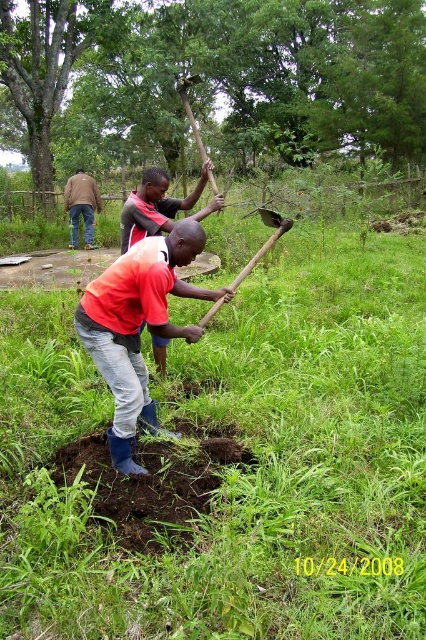
Is green leafy tree at upper center to the right of denim jacket at upper left from the viewer's perspective?

Correct, you'll find green leafy tree at upper center to the right of denim jacket at upper left.

Who is shorter, green leafy tree at upper center or denim jacket at upper left?

Standing shorter between the two is denim jacket at upper left.

Who is more forward, [37,129] or [77,180]?

Positioned in front is point [77,180].

Find the location of a particular element. green leafy tree at upper center is located at coordinates (216, 80).

Is green leafy tree at upper center further to camera compared to matte red shirt at center?

That is True.

Is point (400, 141) positioned behind point (180, 296)?

Yes.

The height and width of the screenshot is (640, 426). Identify the location of green leafy tree at upper center. (216, 80).

Is green grass at center positioned before red shirt at center?

Yes, it is in front of red shirt at center.

Who is more forward, (253, 637) or (132, 218)?

Positioned in front is point (253, 637).

I want to click on green grass at center, so click(229, 461).